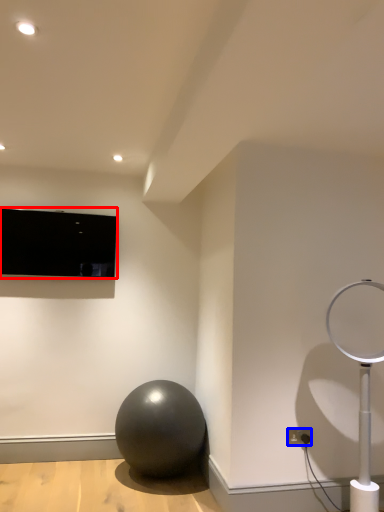
Question: Among these objects, which one is farthest to the camera, television (highlighted by a red box) or electric outlet (highlighted by a blue box)?

Choices:
 (A) television
 (B) electric outlet

Answer: (A)